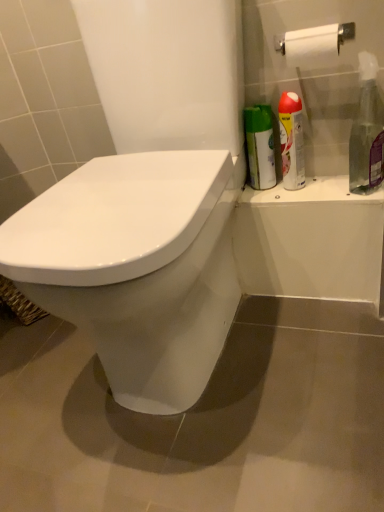
Question: In terms of size, does clear plastic spray bottle at right, marked as the 2th cleaning product in a left-to-right arrangement, appear bigger or smaller than white glossy toilet at center?

Choices:
 (A) small
 (B) big

Answer: (A)

Question: Choose the correct answer: Is clear plastic spray bottle at right, marked as the 2th cleaning product in a left-to-right arrangement, inside white glossy toilet at center or outside it?

Choices:
 (A) inside
 (B) outside

Answer: (B)

Question: Which is farther from the white glossy toilet at center?

Choices:
 (A) clear plastic spray bottle at right, marked as the 2th cleaning product in a left-to-right arrangement
 (B) silver metallic spray can at upper right, the 2th cleaning product in the right-to-left sequence

Answer: (A)

Question: Considering the real-world distances, which object is closest to the clear plastic spray bottle at right, marked as the 2th cleaning product in a left-to-right arrangement?

Choices:
 (A) white glossy toilet at center
 (B) silver metallic spray can at upper right, which is the 1th cleaning product from left to right

Answer: (B)